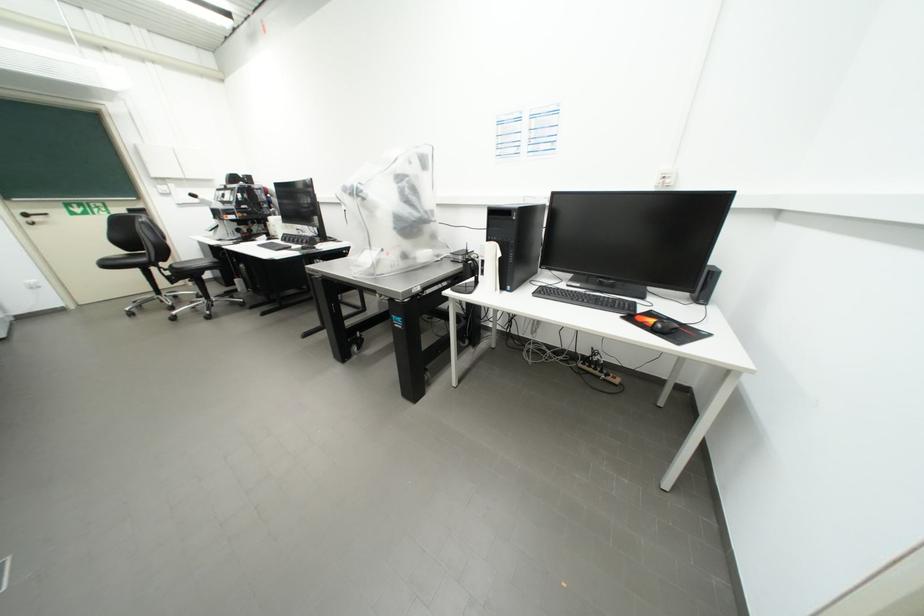
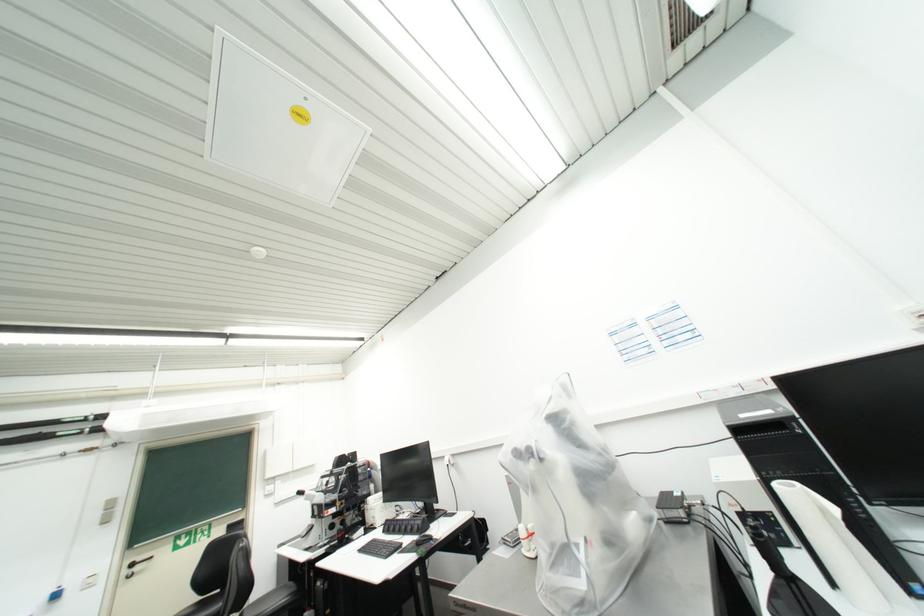
Question: How did the camera likely rotate?

Choices:
 (A) Left
 (B) Right
 (C) Up
 (D) Down

Answer: (C)